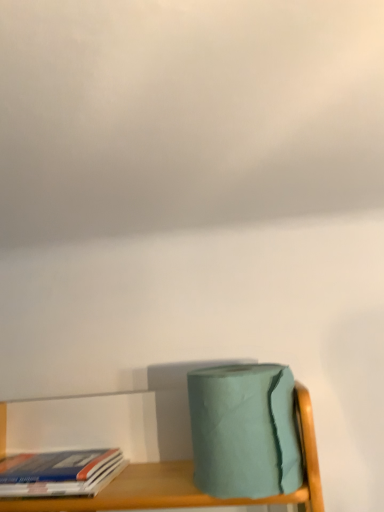
Locate an element on the screen. The width and height of the screenshot is (384, 512). blank space situated above hardcover book at lower left (from a real-world perspective) is located at coordinates (67, 457).